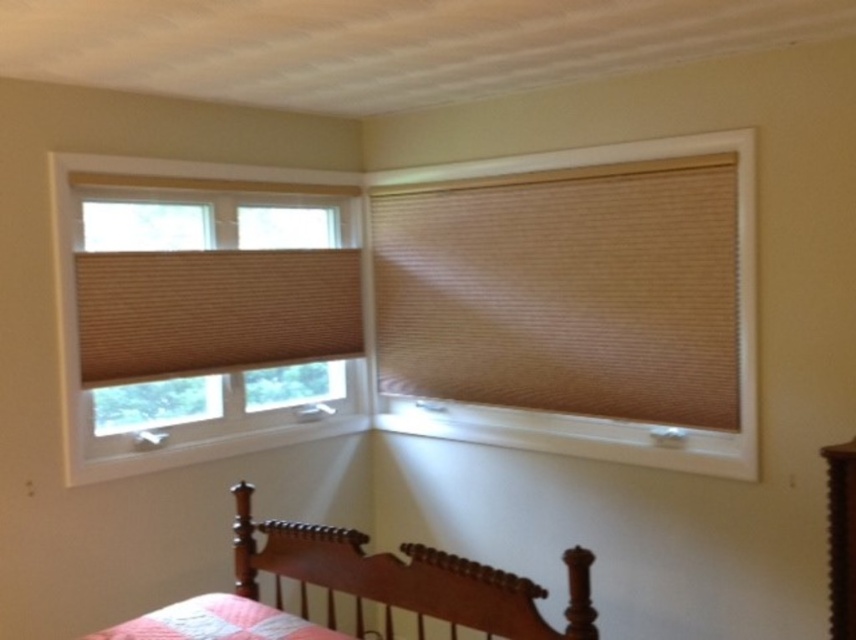
Question: Which point is closer to the camera taking this photo?

Choices:
 (A) (470, 356)
 (B) (382, 579)
 (C) (244, 234)

Answer: (B)

Question: Considering the relative positions of beige textured blind at upper right and tan woven blind at left in the image provided, where is beige textured blind at upper right located with respect to tan woven blind at left?

Choices:
 (A) above
 (B) below

Answer: (A)

Question: Can you confirm if tan woven blinds at left is positioned to the right of tan woven blind at left?

Choices:
 (A) yes
 (B) no

Answer: (B)

Question: Is beige textured blind at upper right positioned behind wooden bed at lower center?

Choices:
 (A) no
 (B) yes

Answer: (B)

Question: Among these objects, which one is nearest to the camera?

Choices:
 (A) tan woven blind at left
 (B) wooden bed at lower center
 (C) wooden dresser at lower right
 (D) tan woven blinds at left

Answer: (B)

Question: Which object is farther from the camera taking this photo?

Choices:
 (A) tan woven blinds at left
 (B) wooden dresser at lower right

Answer: (A)